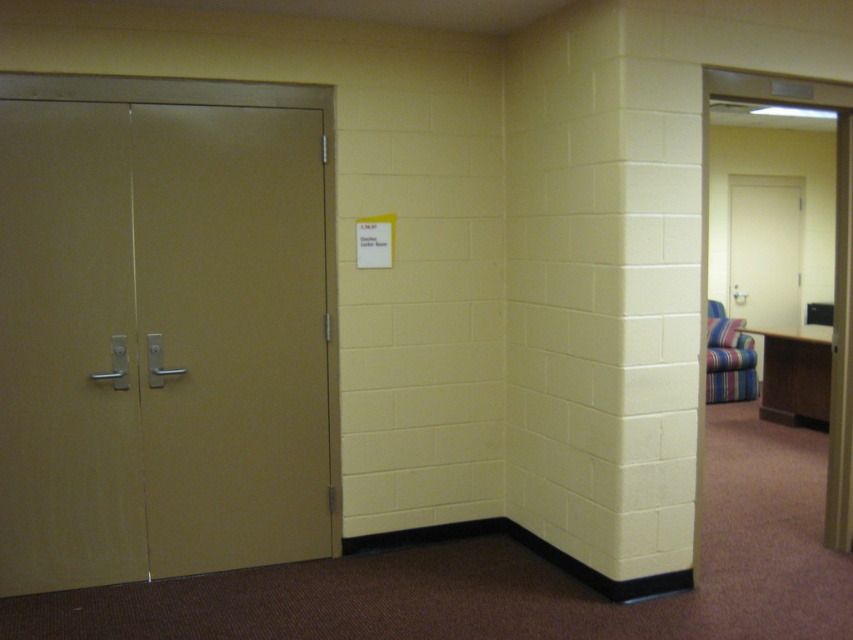
Describe the element at coordinates (164, 328) in the screenshot. The width and height of the screenshot is (853, 640). I see `metallic gold elevator at left` at that location.

Does metallic gold elevator at left appear on the left side of striped fabric armchair at right?

Indeed, metallic gold elevator at left is positioned on the left side of striped fabric armchair at right.

Does point (227, 163) lie behind point (741, 362)?

That is False.

Where is `metallic gold elevator at left`? The image size is (853, 640). metallic gold elevator at left is located at coordinates (164, 328).